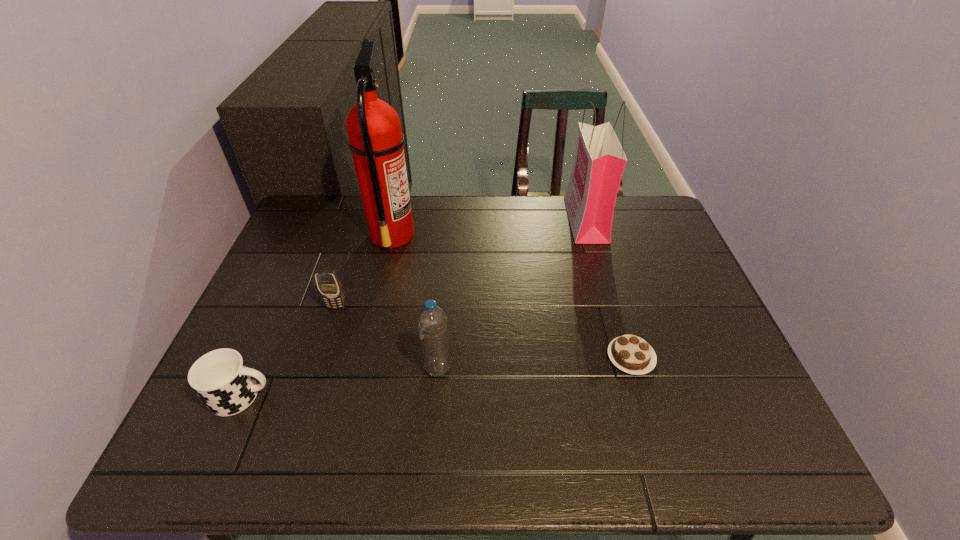
This screenshot has width=960, height=540. Identify the location of free space located 0.270m on the side of the fourth object from right to left near the handle. (502, 234).

Locate an element on the screen. Image resolution: width=960 pixels, height=540 pixels. free space located 0.300m on the front-facing side of the fifth shortest object is located at coordinates (476, 220).

The height and width of the screenshot is (540, 960). Identify the location of free space located 0.390m on the front-facing side of the fifth shortest object. (448, 220).

You are a GUI agent. You are given a task and a screenshot of the screen. Output one action in this format:
    pyautogui.click(x=<x>, y=<y>)
    Task: Click on the free region located 0.220m on the front-facing side of the fifth shortest object
    
    Given the screenshot: What is the action you would take?
    pyautogui.click(x=501, y=220)

The height and width of the screenshot is (540, 960). What are the coordinates of `free space located 0.350m on the back of the fourth shortest object` in the screenshot? It's located at (446, 259).

Find the location of a particular element. Image resolution: width=960 pixels, height=540 pixels. vacant space located 0.230m on the front face of the cellular telephone is located at coordinates (311, 387).

Locate an element on the screen. The image size is (960, 540). vacant region located on the side of the fifth tallest object with the handle is located at coordinates (328, 396).

I want to click on vacant space located on the back of the shortest object, so click(610, 284).

Image resolution: width=960 pixels, height=540 pixels. I want to click on fire extinguisher that is at the far edge, so click(375, 138).

The height and width of the screenshot is (540, 960). Identify the location of shopping bag positioned at the far edge. (599, 162).